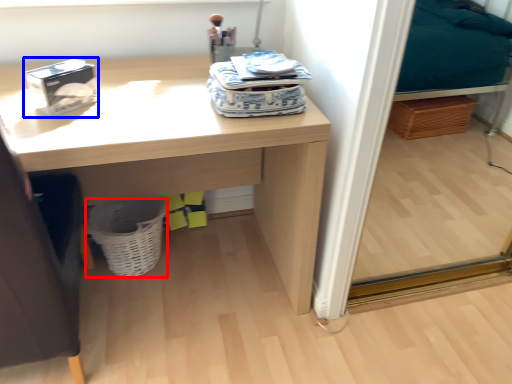
Question: Among these objects, which one is nearest to the camera, basket (highlighted by a red box) or box (highlighted by a blue box)?

Choices:
 (A) basket
 (B) box

Answer: (B)